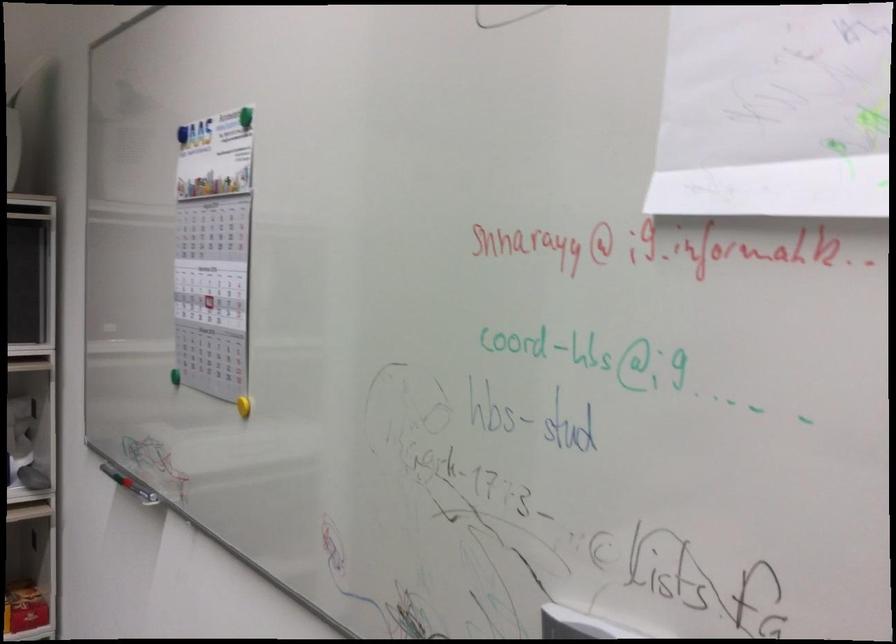
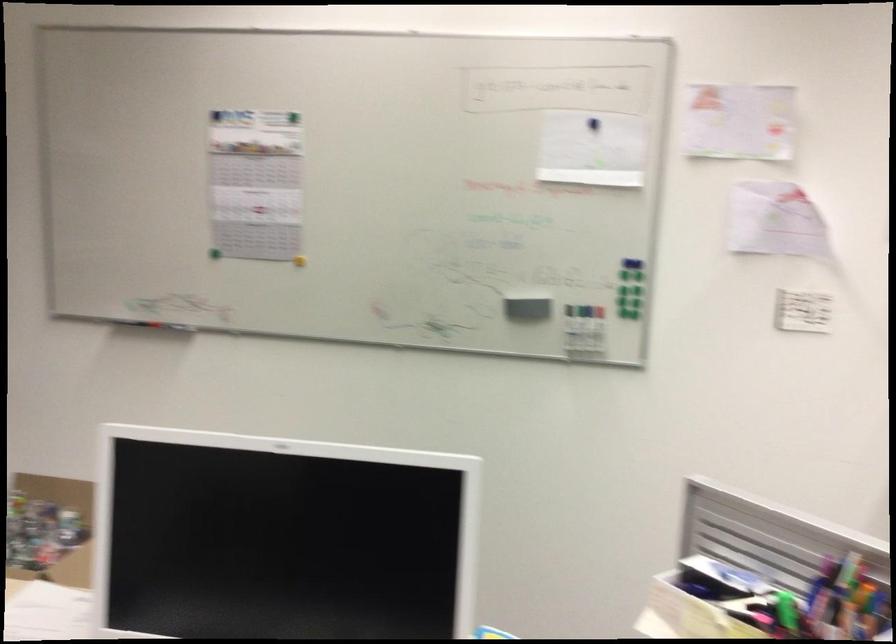
In the second image, find the point that corresponds to [128,478] in the first image.

(158, 325)